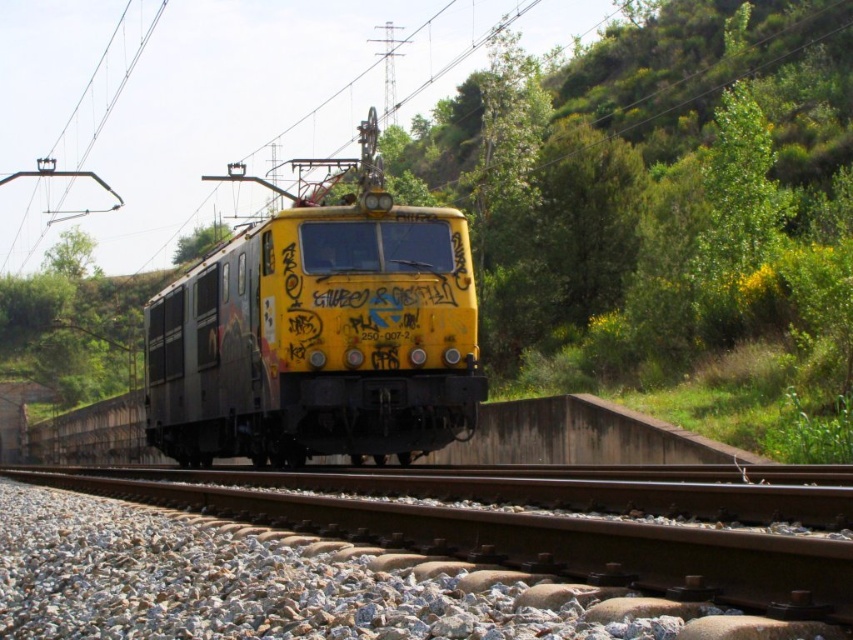
Which of these two, gray gravel at bottom or yellow matte train at center, stands taller?

With more height is yellow matte train at center.

Identify the location of gray gravel at bottom. (434, 556).